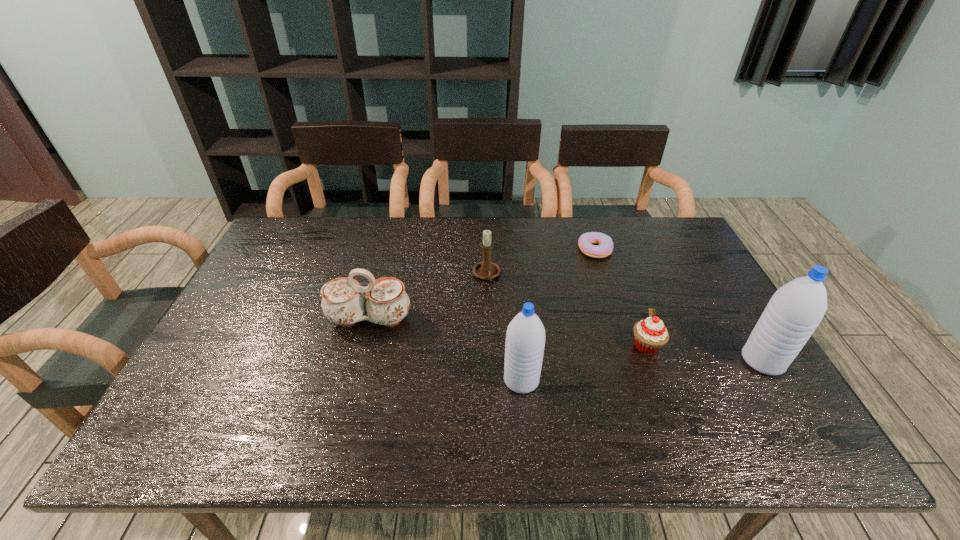
Locate an element on the screen. free point that keeps the water bottles evenly spaced on the left is located at coordinates (259, 401).